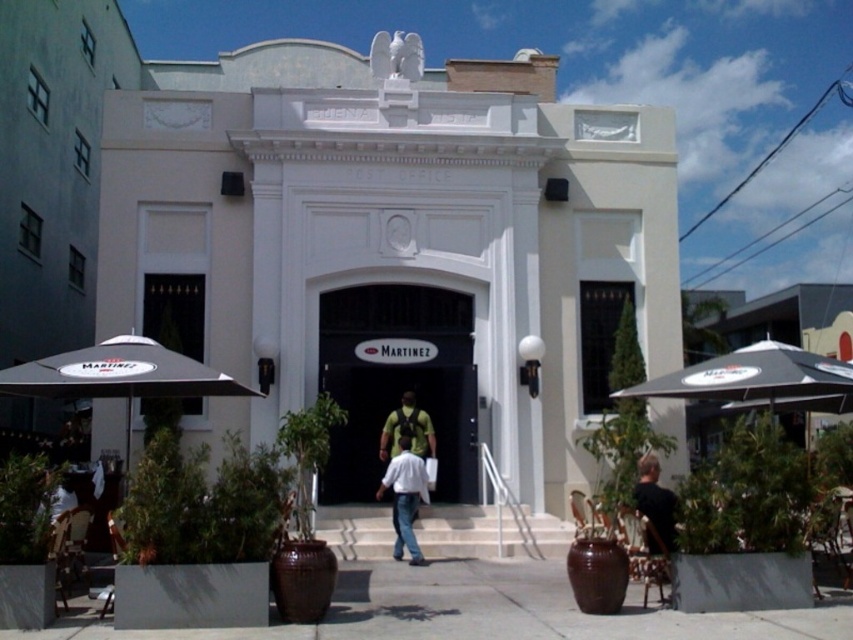
Question: Does black matte door at center have a larger size compared to white cotton shirt at center?

Choices:
 (A) no
 (B) yes

Answer: (B)

Question: Which of the following is the farthest from the observer?

Choices:
 (A) (387, 468)
 (B) (363, 611)

Answer: (A)

Question: Which point is farther to the camera?

Choices:
 (A) black matte door at center
 (B) smooth concrete pavement at center
 (C) white cotton shirt at center

Answer: (A)

Question: Which object appears farthest from the camera in this image?

Choices:
 (A) smooth concrete pavement at center
 (B) black matte door at center
 (C) white cotton shirt at center

Answer: (B)

Question: Does smooth concrete pavement at center have a smaller size compared to white cotton shirt at center?

Choices:
 (A) no
 (B) yes

Answer: (B)

Question: Can you confirm if smooth concrete pavement at center is positioned to the left of white cotton shirt at center?

Choices:
 (A) yes
 (B) no

Answer: (A)